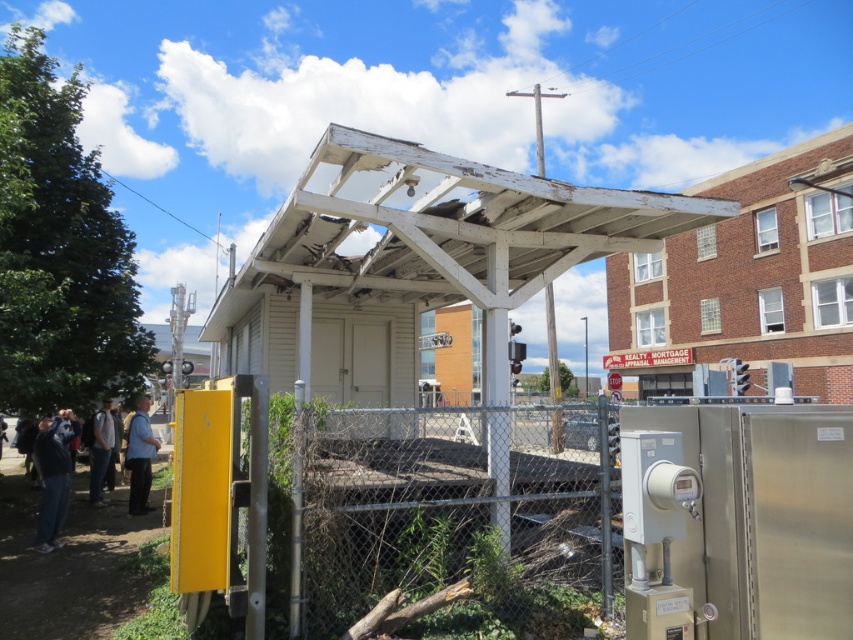
Is chain-link fence at center further to camera compared to brick building at upper right?

No, it is not.

Does chain-link fence at center have a larger size compared to brick building at upper right?

No, chain-link fence at center is not bigger than brick building at upper right.

I want to click on chain-link fence at center, so click(x=444, y=522).

Does brick building at upper right have a lesser height compared to blue fabric shirt at lower left?

No.

At what (x,y) coordinates should I click in order to perform the action: click on brick building at upper right. Please return your answer as a coordinate pair (x, y). This screenshot has width=853, height=640. Looking at the image, I should click on (747, 282).

This screenshot has height=640, width=853. What do you see at coordinates (747, 282) in the screenshot?
I see `brick building at upper right` at bounding box center [747, 282].

Where is `brick building at upper right`? Image resolution: width=853 pixels, height=640 pixels. brick building at upper right is located at coordinates (747, 282).

Can you confirm if dark gray hoodie at lower left is shorter than blue fabric shirt at lower left?

A: Correct, dark gray hoodie at lower left is not as tall as blue fabric shirt at lower left.

Between point (61, 432) and point (131, 470), which one is positioned in front?

Point (61, 432) is more forward.

Is point (56, 532) closer to viewer compared to point (134, 433)?

Yes, point (56, 532) is in front of point (134, 433).

The image size is (853, 640). In order to click on dark gray hoodie at lower left in this screenshot , I will do `click(51, 480)`.